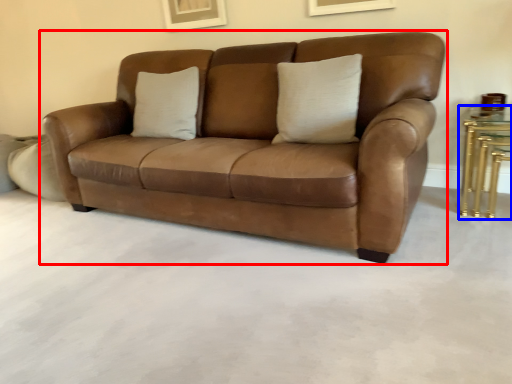
Question: Which object is closer to the camera taking this photo, studio couch (highlighted by a red box) or table (highlighted by a blue box)?

Choices:
 (A) studio couch
 (B) table

Answer: (A)